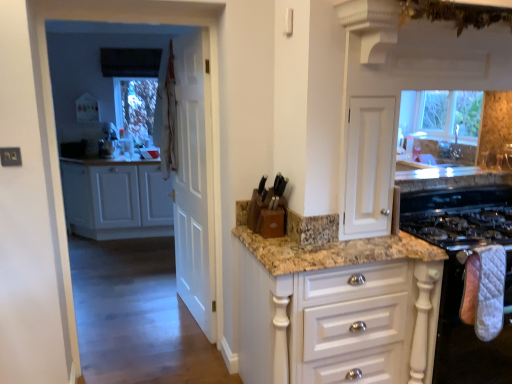
Identify the location of free location in front of white wood cabinets at left, which appears as the 2th cabinetry when viewed from the right. The width and height of the screenshot is (512, 384). (121, 252).